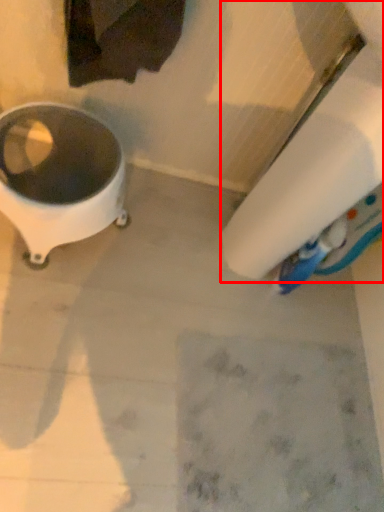
Question: In this image, where is toilet paper (annotated by the red box) located relative to waste container?

Choices:
 (A) left
 (B) right

Answer: (B)